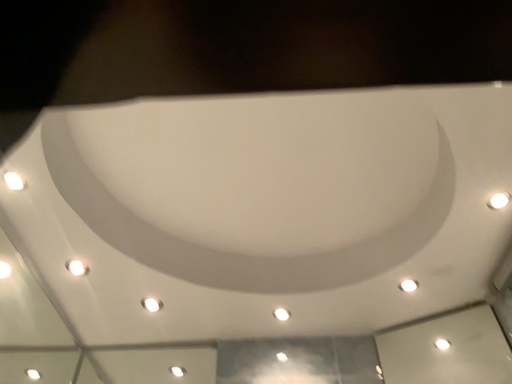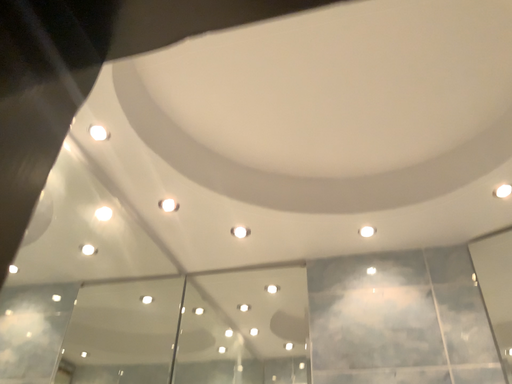
Question: Which way did the camera rotate in the video?

Choices:
 (A) rotated upward
 (B) rotated downward

Answer: (B)